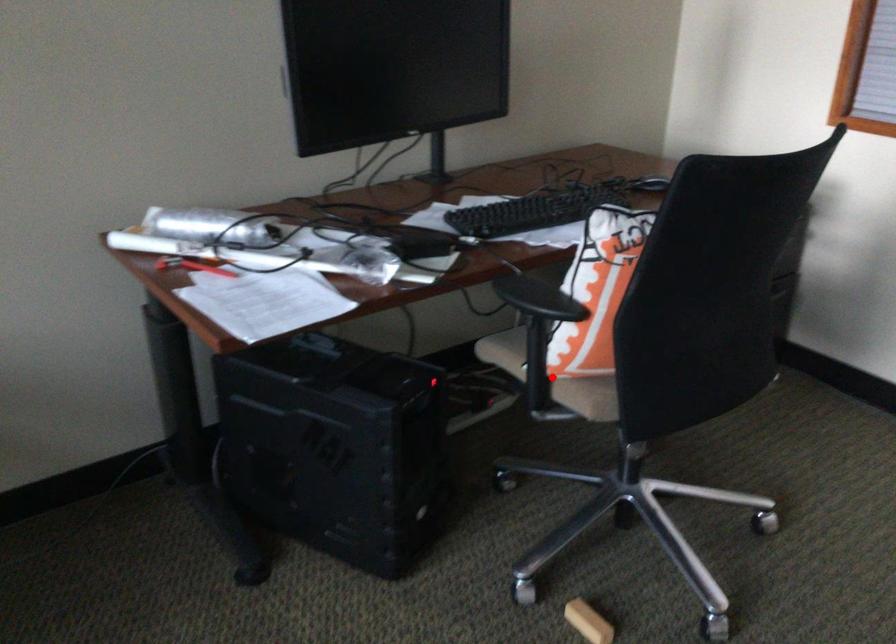
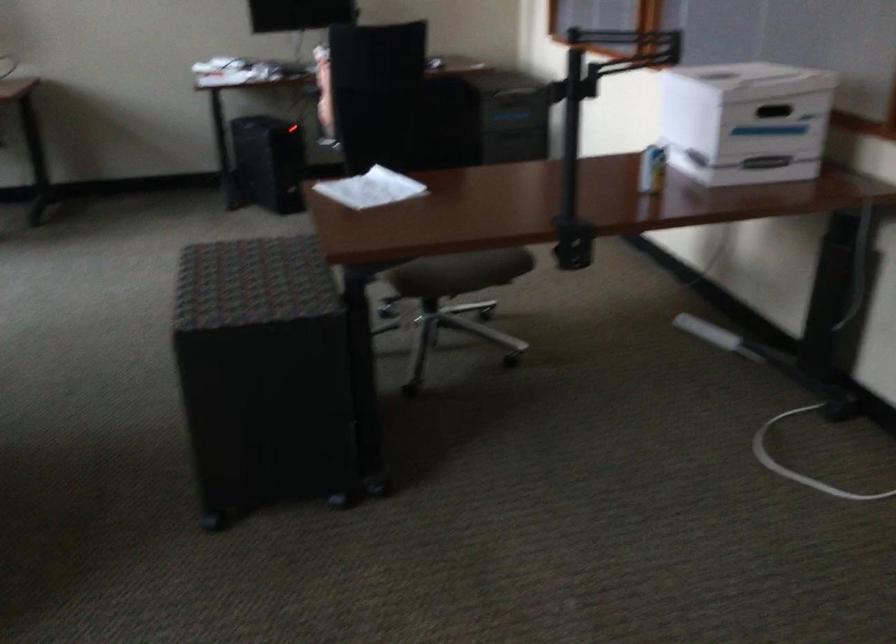
Question: I am providing you with two images of the same scene from different viewpoints. A red point is marked on the first image. At the location where the point appears in image 1, is it still visible in image 2?

Choices:
 (A) Yes
 (B) No

Answer: (B)